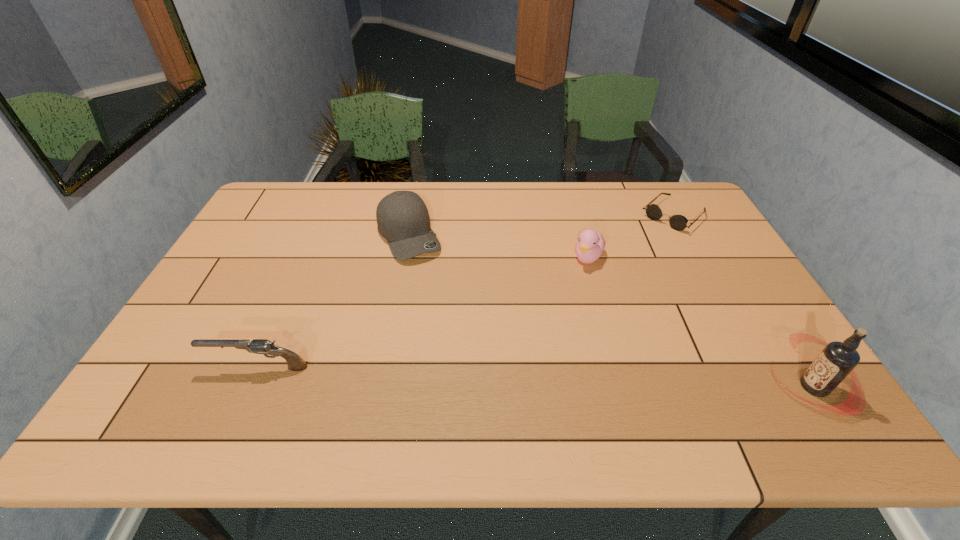
This screenshot has height=540, width=960. What are the coordinates of `free location located on the label of the tallest object` in the screenshot? It's located at (620, 387).

This screenshot has width=960, height=540. Find the location of `free space located on the label of the tallest object`. free space located on the label of the tallest object is located at coordinates (698, 387).

Identify the location of free space located on the front-facing side of the third object from right to left. The height and width of the screenshot is (540, 960). (573, 295).

Where is `free location located on the front-facing side of the third object from right to left`? This screenshot has height=540, width=960. free location located on the front-facing side of the third object from right to left is located at coordinates (549, 346).

This screenshot has width=960, height=540. What are the coordinates of `vacant space located 0.150m on the front-facing side of the third object from right to left` in the screenshot? It's located at (569, 302).

Image resolution: width=960 pixels, height=540 pixels. I want to click on free space located on the front brim of the baseball cap, so click(x=468, y=341).

At what (x,y) coordinates should I click in order to perform the action: click on free spot located on the front brim of the baseball cap. Please return your answer as a coordinate pair (x, y). This screenshot has height=540, width=960. Looking at the image, I should click on (447, 307).

The image size is (960, 540). I want to click on vacant area situated 0.340m on the front brim of the baseball cap, so click(468, 341).

Where is `free region located on the front-facing side of the sunglasses`? This screenshot has width=960, height=540. free region located on the front-facing side of the sunglasses is located at coordinates (619, 266).

This screenshot has height=540, width=960. In order to click on vacant space positioned on the front-facing side of the sunglasses in this screenshot , I will do `click(640, 246)`.